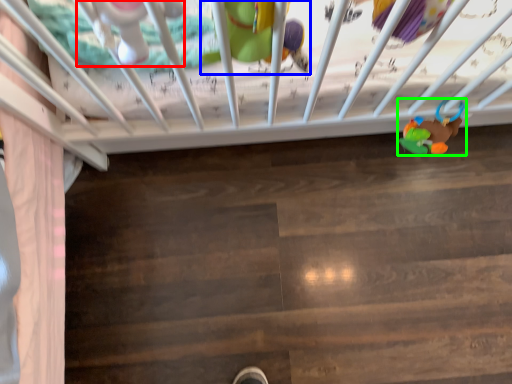
Question: Which object is positioned farthest from toy (highlighted by a red box)? Select from toy (highlighted by a blue box) and toy (highlighted by a green box).

Choices:
 (A) toy
 (B) toy

Answer: (B)